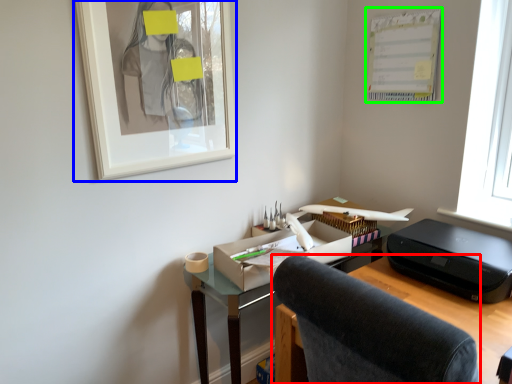
Question: Estimate the real-world distances between objects in this image. Which object is farther from chair (highlighted by a red box), picture frame (highlighted by a blue box) or bulletin board (highlighted by a green box)?

Choices:
 (A) picture frame
 (B) bulletin board

Answer: (B)